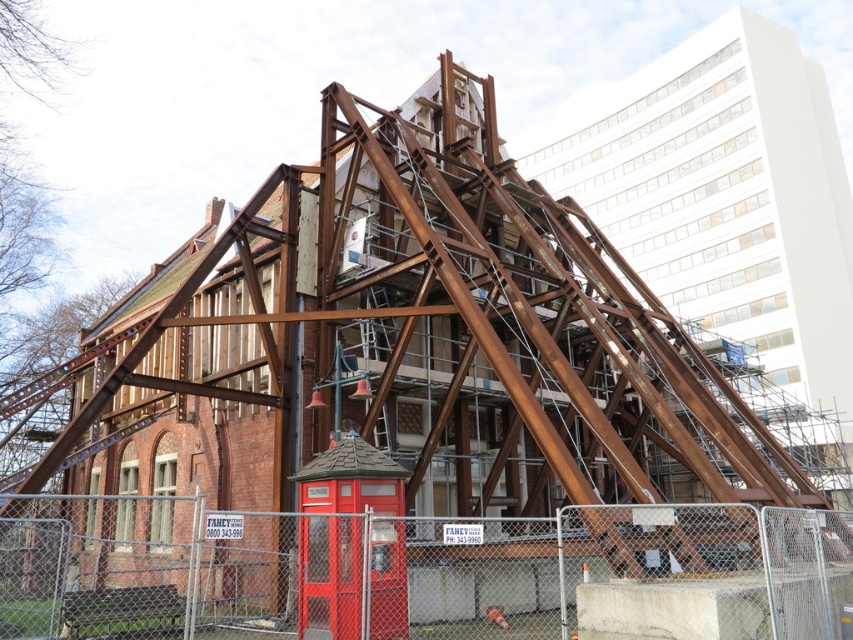
Question: Which point is closer to the camera?

Choices:
 (A) metal chain-link fence at lower center
 (B) matte red telephone box at lower center

Answer: (A)

Question: Among these objects, which one is nearest to the camera?

Choices:
 (A) metal chain-link fence at lower center
 (B) matte red telephone box at lower center

Answer: (A)

Question: Does metal chain-link fence at lower center appear on the left side of matte red telephone box at lower center?

Choices:
 (A) yes
 (B) no

Answer: (A)

Question: Can you confirm if metal chain-link fence at lower center is thinner than matte red telephone box at lower center?

Choices:
 (A) no
 (B) yes

Answer: (A)

Question: Can you confirm if metal chain-link fence at lower center is positioned above matte red telephone box at lower center?

Choices:
 (A) yes
 (B) no

Answer: (B)